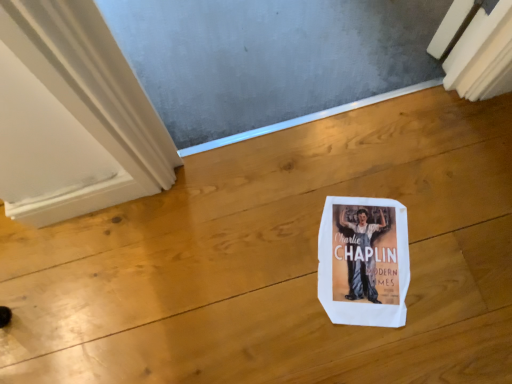
Identify the location of vacant region above white paper bag at center (from a real-world perspective). (350, 253).